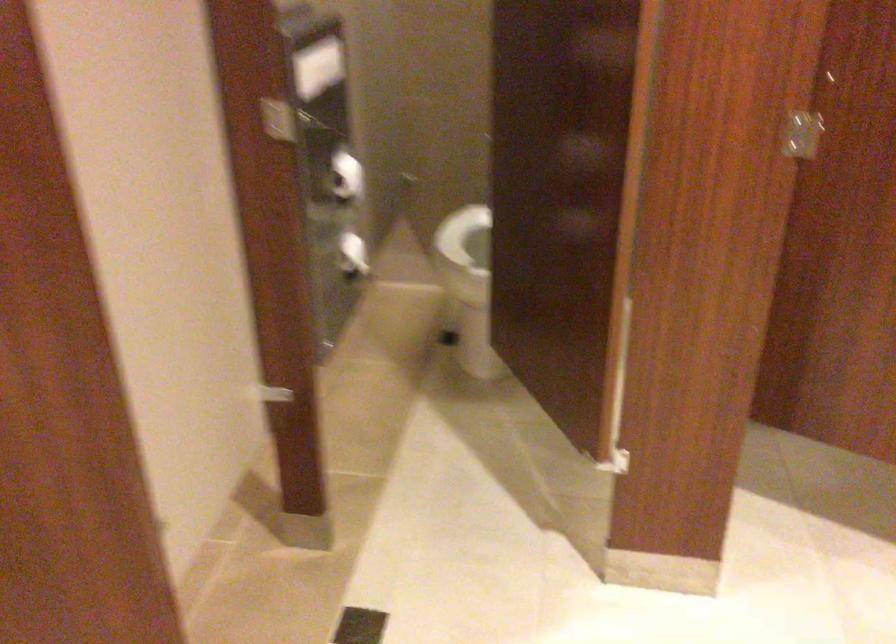
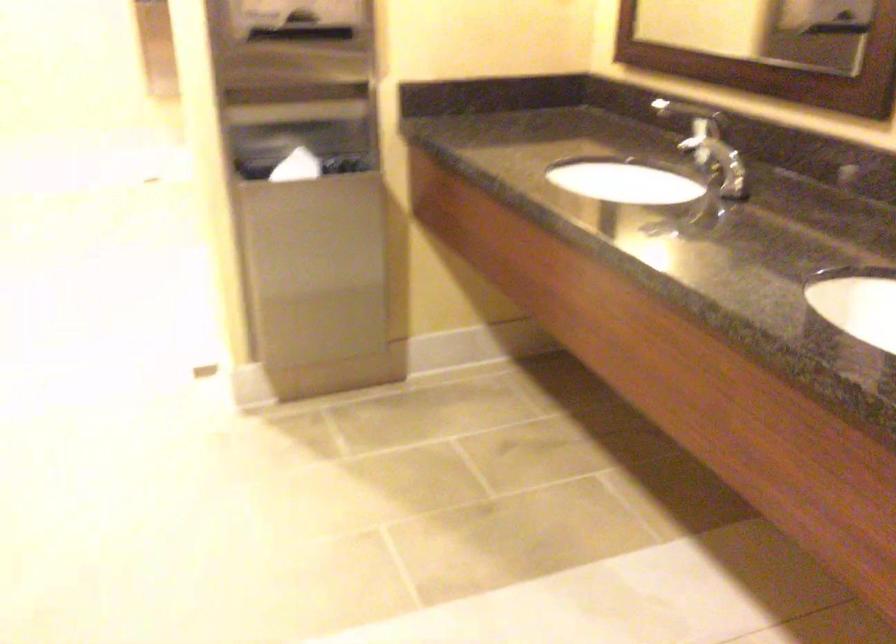
The images are taken continuously from a first-person perspective. In which direction is your viewpoint rotating?

The camera's rotation is toward right-down.